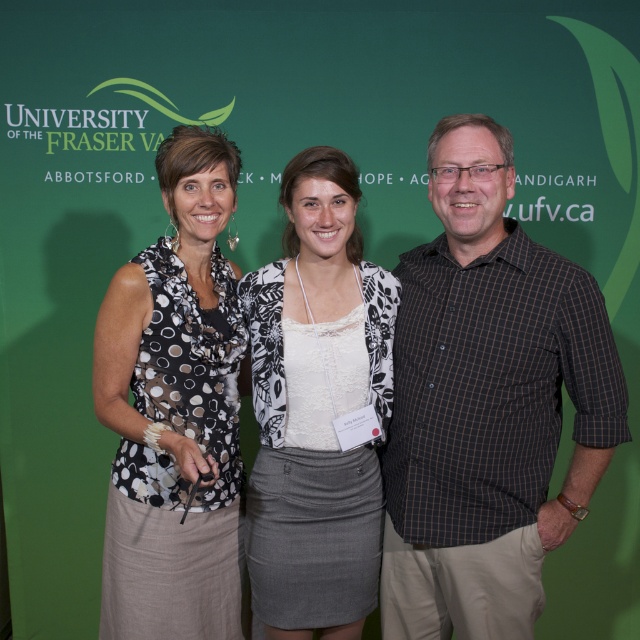
You are standing 5 feet away from the camera. Can you reach the brown checkered shirt at center if you move forward?

The brown checkered shirt at center is 4.63 feet away from the camera. Since you are currently 5 feet away, moving forward by 0.37 feet would allow you to reach it.

You are a photographer setting up a shoot with two models wearing the brown checkered shirt at center and the white textured blouse at center. Which model should you ask to move back slightly to create more space between them?

The brown checkered shirt at center is in front of the white textured blouse at center, so you should ask the model wearing the brown checkered shirt at center to move back slightly to create more space between them.

You are organizing a photo shoot and need to ensure that all participants are visible in the frame. Given that the brown checkered shirt at center and the black dotted blouse at left are part of the group, which clothing item requires more space to accommodate its size?

The brown checkered shirt at center requires more space because it is bigger than the black dotted blouse at left.